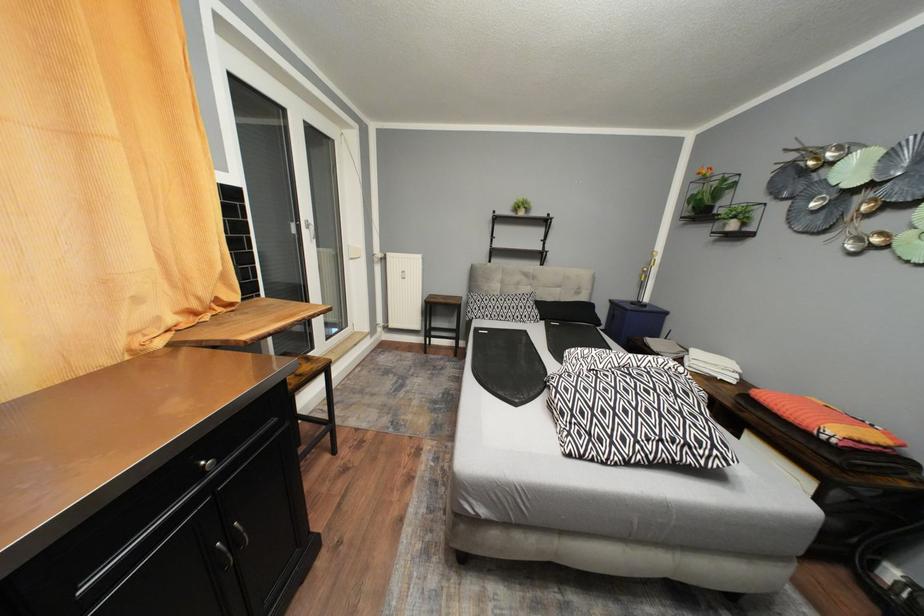
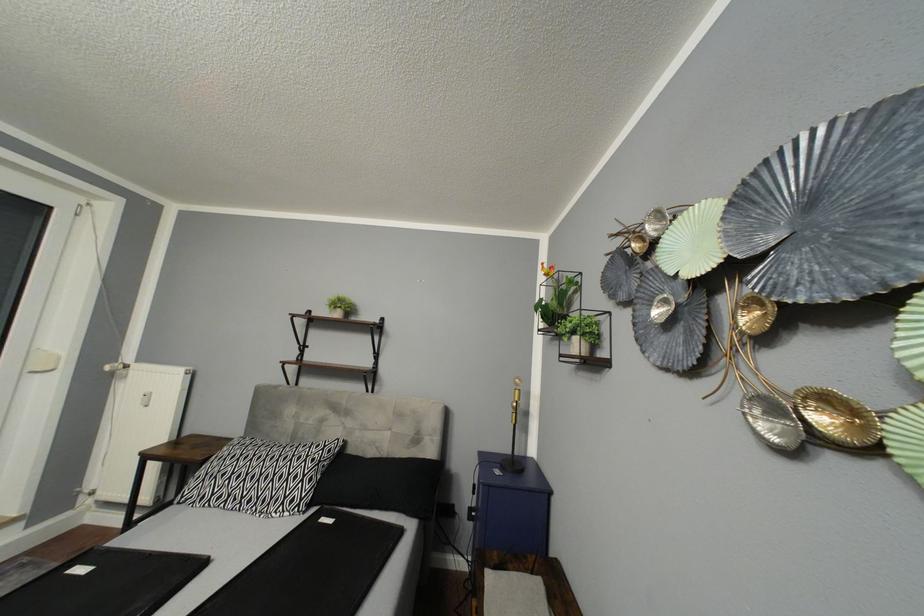
Which direction would the cameraman need to move to produce the second image?

The cameraman walked toward right, forward.